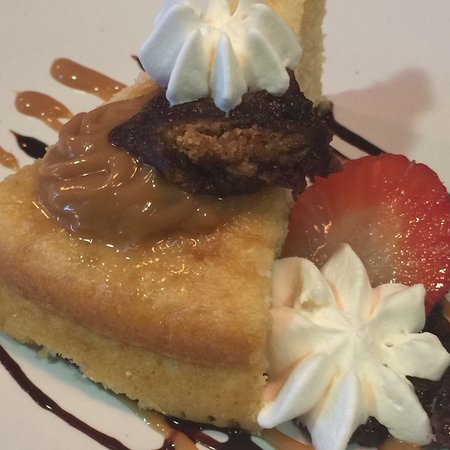
You are a GUI agent. You are given a task and a screenshot of the screen. Output one action in this format:
    pyautogui.click(x=<x>, y=<y>)
    Task: Click on the white plate underneath the dessert
    Image resolution: width=450 pixels, height=450 pixels.
    Given the screenshot: What is the action you would take?
    pyautogui.click(x=126, y=29), pyautogui.click(x=30, y=30), pyautogui.click(x=57, y=381), pyautogui.click(x=117, y=426), pyautogui.click(x=27, y=435), pyautogui.click(x=351, y=41), pyautogui.click(x=434, y=37), pyautogui.click(x=377, y=120), pyautogui.click(x=435, y=145)